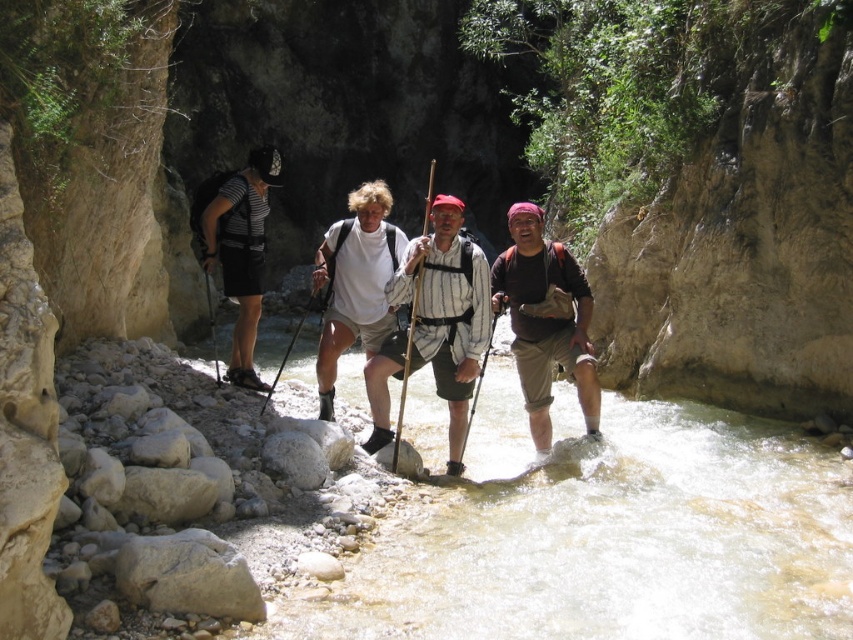
Question: Can you confirm if matte khaki shorts at center is smaller than striped fabric backpack at left?

Choices:
 (A) no
 (B) yes

Answer: (A)

Question: Which point is closer to the camera?

Choices:
 (A) matte khaki shorts at center
 (B) white cotton shirt at center
 (C) striped cotton shirt at center

Answer: (C)

Question: Where is striped cotton shirt at center located in relation to matte khaki shorts at center in the image?

Choices:
 (A) left
 (B) right

Answer: (A)

Question: Which point appears closest to the camera in this image?

Choices:
 (A) (409, 262)
 (B) (518, 269)

Answer: (A)

Question: Among these points, which one is farthest from the camera?

Choices:
 (A) (248, 275)
 (B) (440, 282)
 (C) (563, 273)
 (D) (459, 211)

Answer: (A)

Question: Is white cotton shirt at center further to the viewer compared to striped fabric backpack at left?

Choices:
 (A) no
 (B) yes

Answer: (A)